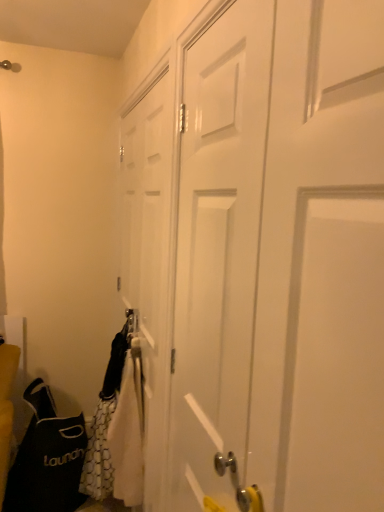
Question: Considering the relative sizes of black fabric laundry bag at lower left and white matte door at center, which appears as the second door when viewed from the front, in the image provided, is black fabric laundry bag at lower left shorter than white matte door at center, which appears as the second door when viewed from the front,?

Choices:
 (A) no
 (B) yes

Answer: (B)

Question: Is black fabric laundry bag at lower left wider than white matte door at center, which appears as the second door when viewed from the front?

Choices:
 (A) yes
 (B) no

Answer: (A)

Question: Is black fabric laundry bag at lower left far from white matte door at center, which appears as the second door when viewed from the front?

Choices:
 (A) no
 (B) yes

Answer: (A)

Question: Can you confirm if black fabric laundry bag at lower left is bigger than white matte door at center, the first door viewed from the back?

Choices:
 (A) yes
 (B) no

Answer: (A)

Question: From a real-world perspective, does black fabric laundry bag at lower left stand above white matte door at center, which appears as the second door when viewed from the front?

Choices:
 (A) no
 (B) yes

Answer: (A)

Question: Is white matte door at center, which appears as the second door when viewed from the front, at the back of black fabric laundry bag at lower left?

Choices:
 (A) no
 (B) yes

Answer: (A)

Question: Considering the relative sizes of white matte door at center, the first door viewed from the back, and black fabric laundry bag at lower left in the image provided, is white matte door at center, the first door viewed from the back, thinner than black fabric laundry bag at lower left?

Choices:
 (A) no
 (B) yes

Answer: (B)

Question: Can you confirm if white matte door at center, the first door viewed from the back, is bigger than black fabric laundry bag at lower left?

Choices:
 (A) no
 (B) yes

Answer: (A)

Question: Is white matte door at center, the first door viewed from the back, further to camera compared to black fabric laundry bag at lower left?

Choices:
 (A) no
 (B) yes

Answer: (A)

Question: Is white matte door at center, which appears as the second door when viewed from the front, shorter than black fabric laundry bag at lower left?

Choices:
 (A) yes
 (B) no

Answer: (B)

Question: From the image's perspective, is white matte door at center, which appears as the second door when viewed from the front, above black fabric laundry bag at lower left?

Choices:
 (A) yes
 (B) no

Answer: (A)

Question: Is white matte door at center, which appears as the second door when viewed from the front, oriented away from black fabric laundry bag at lower left?

Choices:
 (A) no
 (B) yes

Answer: (B)

Question: Is black fabric laundry bag at lower left closer to camera compared to white matte door at center, the second door in the back-to-front sequence?

Choices:
 (A) yes
 (B) no

Answer: (B)